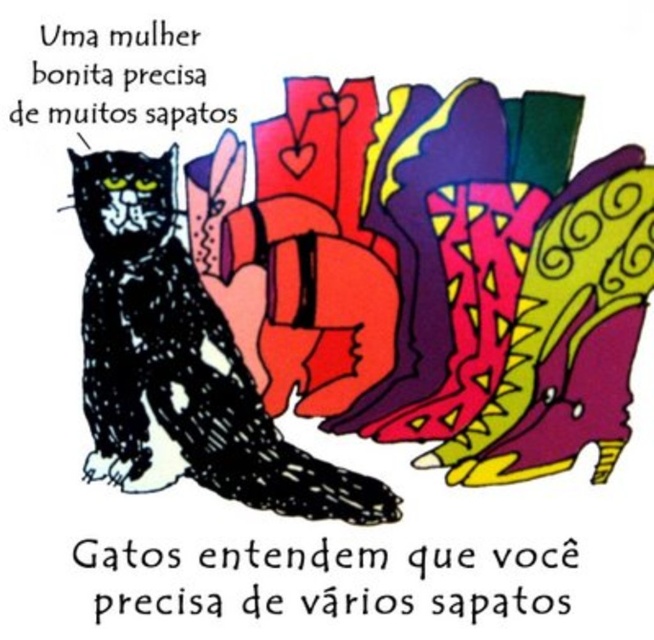
Question: Does black textured cat at left have a lesser width compared to black glossy cat at left?

Choices:
 (A) no
 (B) yes

Answer: (A)

Question: Is black textured cat at left smaller than black glossy cat at left?

Choices:
 (A) no
 (B) yes

Answer: (A)

Question: Does black textured cat at left lie behind black glossy cat at left?

Choices:
 (A) no
 (B) yes

Answer: (B)

Question: Which point is closer to the camera?

Choices:
 (A) black textured cat at left
 (B) black glossy cat at left

Answer: (B)

Question: Which point is closer to the camera taking this photo?

Choices:
 (A) (145, 216)
 (B) (141, 189)

Answer: (B)